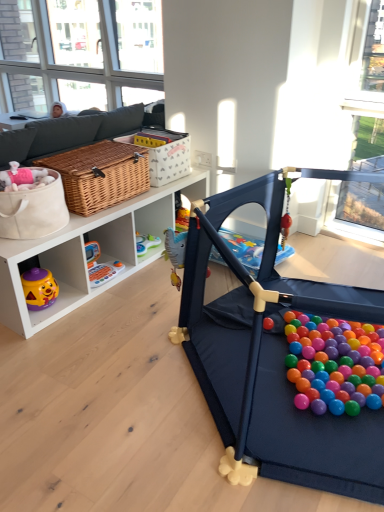
This screenshot has width=384, height=512. I want to click on vacant area that is in front of rubberized plastic toy at lower left, the second toy from the right, so click(94, 293).